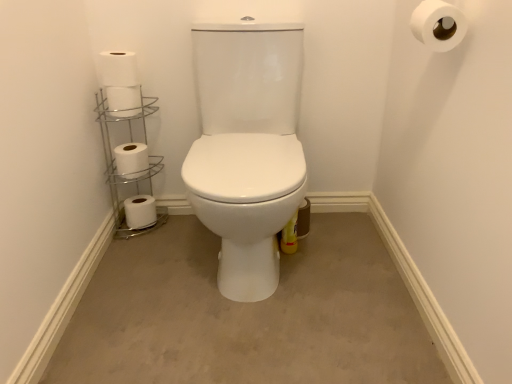
In order to click on free space in front of silver/metallic toilet paper holder at left in this screenshot , I will do `click(136, 253)`.